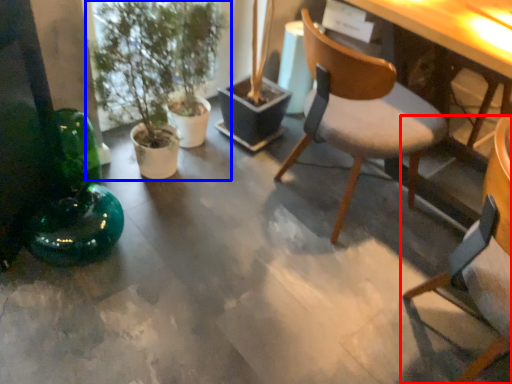
Question: Among these objects, which one is nearest to the camera, chair (highlighted by a red box) or houseplant (highlighted by a blue box)?

Choices:
 (A) chair
 (B) houseplant

Answer: (A)